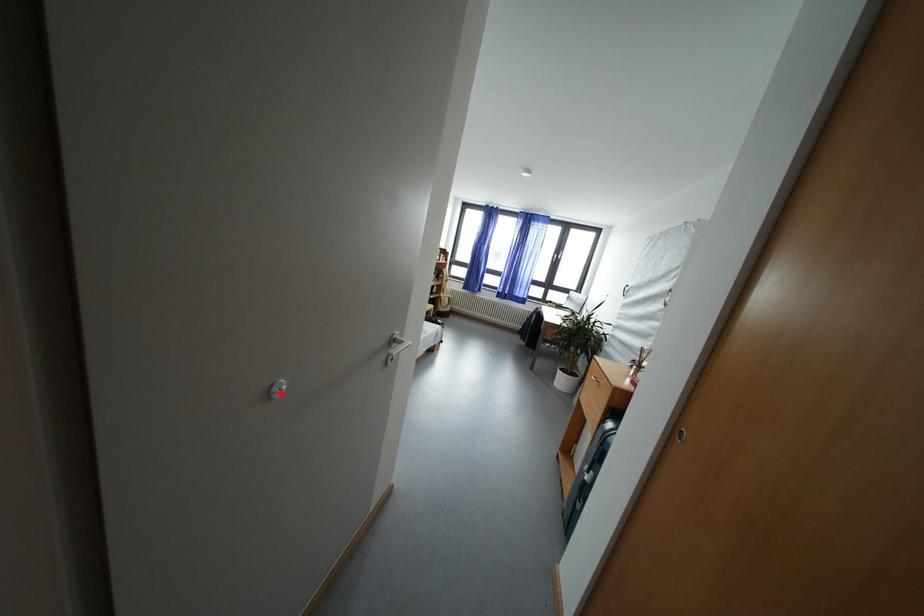
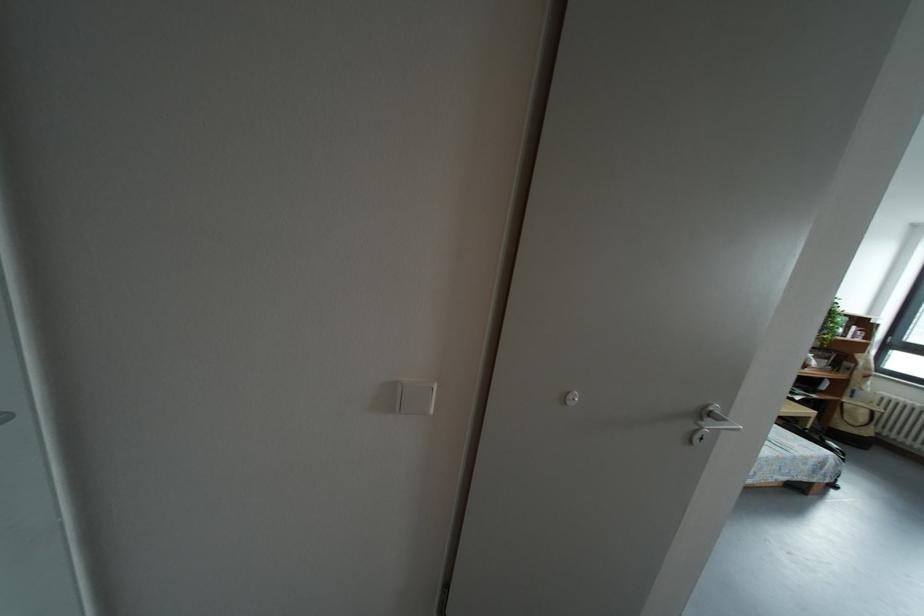
Locate, in the second image, the point that corresponds to the highlighted location in the first image.

(577, 402)